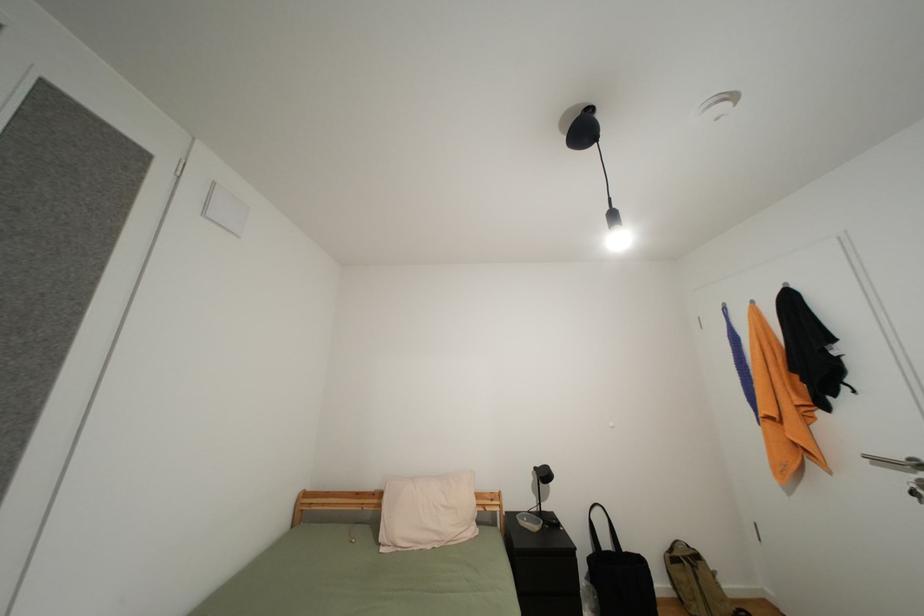
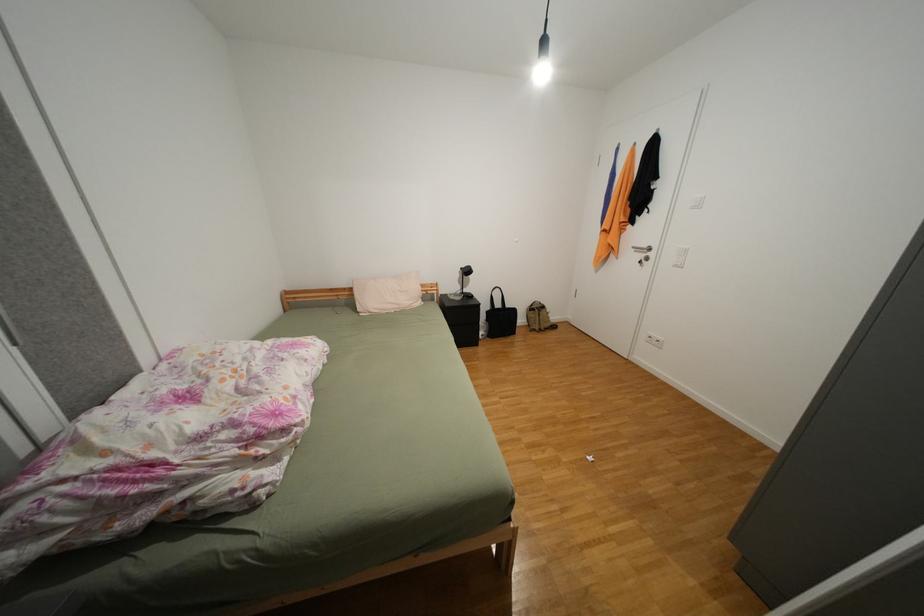
Based on the continuous images, in which direction is the camera rotating?

The camera rotated toward right-down.